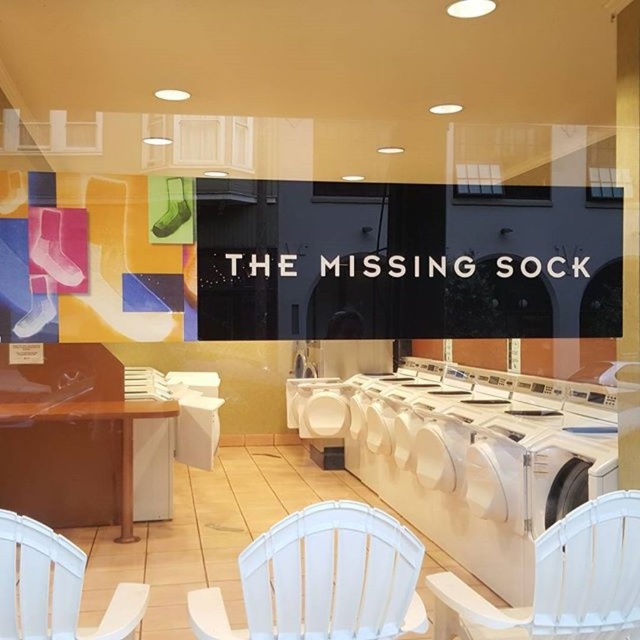
Does white plastic chair at center have a smaller size compared to white plastic chair at lower left?

Incorrect, white plastic chair at center is not smaller in size than white plastic chair at lower left.

Who is higher up, white plastic chair at center or white plastic chair at lower left?

white plastic chair at center is above.

The width and height of the screenshot is (640, 640). Identify the location of white plastic chair at center. (323, 579).

Can you confirm if white plastic washer at center is positioned to the left of white plastic chair at lower left?

No, white plastic washer at center is not to the left of white plastic chair at lower left.

Consider the image. Between white plastic washer at center and white plastic chair at lower left, which one has more height?

white plastic washer at center is taller.

Where is `white plastic washer at center`? white plastic washer at center is located at coordinates (472, 454).

The width and height of the screenshot is (640, 640). Find the location of `white plastic washer at center`. white plastic washer at center is located at coordinates (472, 454).

At what (x,y) coordinates should I click in order to perform the action: click on white plastic chair at center. Please return your answer as a coordinate pair (x, y). Image resolution: width=640 pixels, height=640 pixels. Looking at the image, I should click on pos(323,579).

Does white plastic chair at center appear on the right side of white plastic chair at lower right?

Incorrect, white plastic chair at center is not on the right side of white plastic chair at lower right.

You are a GUI agent. You are given a task and a screenshot of the screen. Output one action in this format:
    pyautogui.click(x=<x>, y=<y>)
    Task: Click on the white plastic chair at center
    The height and width of the screenshot is (640, 640).
    Given the screenshot: What is the action you would take?
    pyautogui.click(x=323, y=579)

Where is `white plastic chair at center`? This screenshot has width=640, height=640. white plastic chair at center is located at coordinates (323, 579).